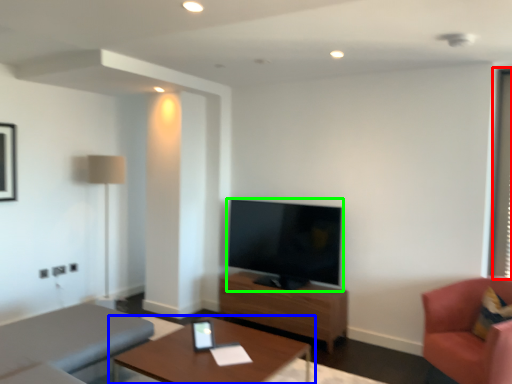
Question: Which object is the farthest from window screen (highlighted by a red box)? Choose among these: table (highlighted by a blue box) or television (highlighted by a green box).

Choices:
 (A) table
 (B) television

Answer: (A)